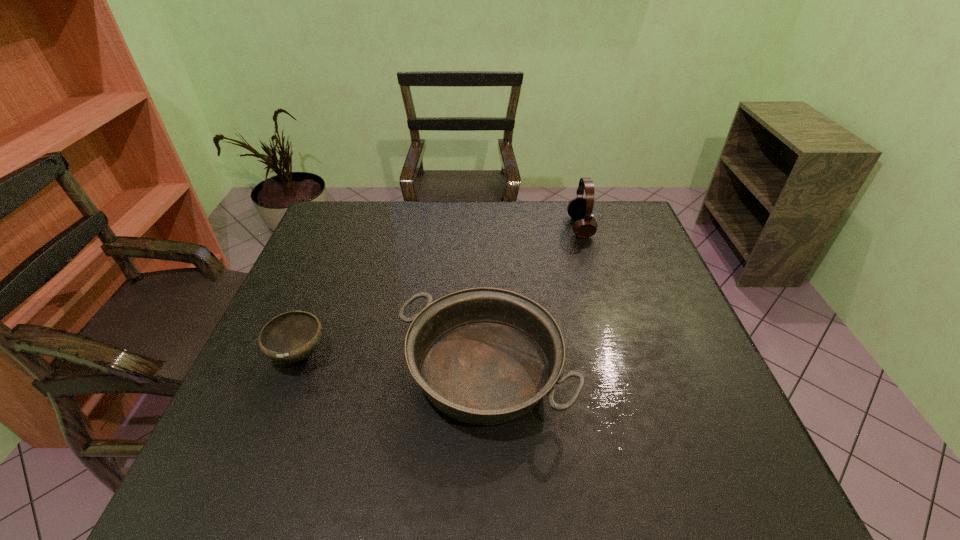
The image size is (960, 540). I want to click on vacant position at the far right corner of the desktop, so click(x=616, y=240).

Find the location of `unoccupied position between the second tallest object and the shortest object`. unoccupied position between the second tallest object and the shortest object is located at coordinates (392, 363).

The height and width of the screenshot is (540, 960). Find the location of `free space between the pan and the shortest object`. free space between the pan and the shortest object is located at coordinates (392, 363).

Locate an element on the screen. The width and height of the screenshot is (960, 540). unoccupied area between the leftmost object and the second shortest object is located at coordinates (392, 363).

At what (x,y) coordinates should I click in order to perform the action: click on empty location between the rightmost object and the leftmost object. Please return your answer as a coordinate pair (x, y). The height and width of the screenshot is (540, 960). Looking at the image, I should click on (440, 291).

Locate an element on the screen. This screenshot has height=540, width=960. free spot between the second object from left to right and the shortest object is located at coordinates (392, 363).

You are a GUI agent. You are given a task and a screenshot of the screen. Output one action in this format:
    pyautogui.click(x=<x>, y=<y>)
    Task: Click on the free space between the second object from left to right and the bowl
    This screenshot has height=540, width=960.
    Given the screenshot: What is the action you would take?
    pyautogui.click(x=392, y=363)

Where is `free space between the shortest object and the second shortest object`? The height and width of the screenshot is (540, 960). free space between the shortest object and the second shortest object is located at coordinates (392, 363).

Image resolution: width=960 pixels, height=540 pixels. I want to click on vacant space that's between the tallest object and the bowl, so click(440, 291).

This screenshot has height=540, width=960. In order to click on unoccupied area between the bowl and the second object from right to left in this screenshot , I will do `click(392, 363)`.